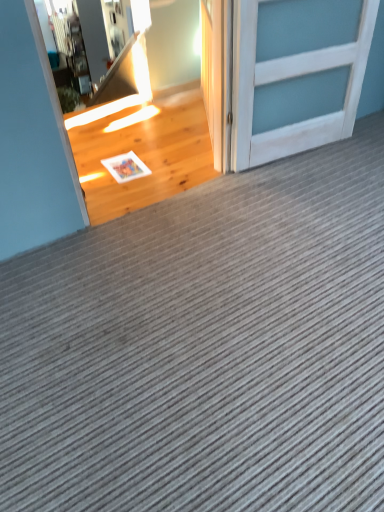
You are a GUI agent. You are given a task and a screenshot of the screen. Output one action in this format:
    pyautogui.click(x=<x>, y=<y>)
    Task: Click on the white wood door at upper right, placed as the 2th door when sorted from right to left
    
    Given the screenshot: What is the action you would take?
    pyautogui.click(x=213, y=73)

The width and height of the screenshot is (384, 512). What do you see at coordinates (213, 73) in the screenshot?
I see `white wood door at upper right, placed as the 2th door when sorted from right to left` at bounding box center [213, 73].

The width and height of the screenshot is (384, 512). What do you see at coordinates (292, 87) in the screenshot? I see `white wood door at upper right, the second door when ordered from left to right` at bounding box center [292, 87].

Locate an element on the screen. Image resolution: width=384 pixels, height=512 pixels. white wood door at upper right, the first door when ordered from right to left is located at coordinates (292, 87).

This screenshot has width=384, height=512. What are the coordinates of `white wood door at upper right, placed as the 2th door when sorted from right to left` in the screenshot? It's located at (213, 73).

Would you say white wood door at upper right, placed as the 1th door when sorted from left to right, is to the left or to the right of white wood door at upper right, the first door when ordered from right to left, in the picture?

From the image, it's evident that white wood door at upper right, placed as the 1th door when sorted from left to right, is to the left of white wood door at upper right, the first door when ordered from right to left.

Does white wood door at upper right, placed as the 1th door when sorted from left to right, come in front of white wood door at upper right, the first door when ordered from right to left?

No, it is behind white wood door at upper right, the first door when ordered from right to left.

Considering the positions of point (217, 16) and point (272, 66), is point (217, 16) closer or farther from the camera than point (272, 66)?

Point (217, 16) is positioned closer to the camera compared to point (272, 66).

From the image's perspective, which is below, white wood door at upper right, placed as the 1th door when sorted from left to right, or white wood door at upper right, the first door when ordered from right to left?

white wood door at upper right, the first door when ordered from right to left.

From a real-world perspective, is white wood door at upper right, placed as the 1th door when sorted from left to right, physically located above or below white wood door at upper right, the first door when ordered from right to left?

white wood door at upper right, placed as the 1th door when sorted from left to right, is below white wood door at upper right, the first door when ordered from right to left.

Looking at their sizes, would you say white wood door at upper right, placed as the 1th door when sorted from left to right, is wider or thinner than white wood door at upper right, the first door when ordered from right to left?

white wood door at upper right, placed as the 1th door when sorted from left to right, is thinner than white wood door at upper right, the first door when ordered from right to left.

Considering the relative sizes of white wood door at upper right, placed as the 1th door when sorted from left to right, and white wood door at upper right, the first door when ordered from right to left, in the image provided, is white wood door at upper right, placed as the 1th door when sorted from left to right, taller than white wood door at upper right, the first door when ordered from right to left,?

In fact, white wood door at upper right, placed as the 1th door when sorted from left to right, may be shorter than white wood door at upper right, the first door when ordered from right to left.

Considering the sizes of white wood door at upper right, placed as the 2th door when sorted from right to left, and white wood door at upper right, the first door when ordered from right to left, in the image, is white wood door at upper right, placed as the 2th door when sorted from right to left, bigger or smaller than white wood door at upper right, the first door when ordered from right to left,?

white wood door at upper right, placed as the 2th door when sorted from right to left, is smaller than white wood door at upper right, the first door when ordered from right to left.

Is white wood door at upper right, placed as the 1th door when sorted from left to right, spatially inside white wood door at upper right, the first door when ordered from right to left, or outside of it?

The correct answer is: outside.

Is white wood door at upper right, placed as the 1th door when sorted from left to right, aimed at white wood door at upper right, the second door when ordered from left to right?

No, white wood door at upper right, placed as the 1th door when sorted from left to right, is not facing towards white wood door at upper right, the second door when ordered from left to right.

Looking at this image, measure the distance from white wood door at upper right, placed as the 2th door when sorted from right to left, to white wood door at upper right, the first door when ordered from right to left.

A distance of 14.02 inches exists between white wood door at upper right, placed as the 2th door when sorted from right to left, and white wood door at upper right, the first door when ordered from right to left.

The height and width of the screenshot is (512, 384). Identify the location of door located on the right of white wood door at upper right, placed as the 1th door when sorted from left to right. (292, 87).

Based on the photo, considering the positions of objects white wood door at upper right, the first door when ordered from right to left, and white wood door at upper right, placed as the 1th door when sorted from left to right, in the image provided, who is more to the right, white wood door at upper right, the first door when ordered from right to left, or white wood door at upper right, placed as the 1th door when sorted from left to right,?

From the viewer's perspective, white wood door at upper right, the first door when ordered from right to left, appears more on the right side.

In the image, is white wood door at upper right, the first door when ordered from right to left, positioned in front of or behind white wood door at upper right, placed as the 1th door when sorted from left to right?

Clearly, white wood door at upper right, the first door when ordered from right to left, is in front of white wood door at upper right, placed as the 1th door when sorted from left to right.

Is point (354, 77) behind point (222, 85)?

Yes, it is behind point (222, 85).

From the image's perspective, is white wood door at upper right, the first door when ordered from right to left, over white wood door at upper right, placed as the 1th door when sorted from left to right?

No, from the image's perspective, white wood door at upper right, the first door when ordered from right to left, is not on top of white wood door at upper right, placed as the 1th door when sorted from left to right.

From a real-world perspective, who is located higher, white wood door at upper right, the first door when ordered from right to left, or white wood door at upper right, placed as the 2th door when sorted from right to left?

white wood door at upper right, the first door when ordered from right to left.

Which object is wider, white wood door at upper right, the second door when ordered from left to right, or white wood door at upper right, placed as the 1th door when sorted from left to right?

Wider between the two is white wood door at upper right, the second door when ordered from left to right.

Can you confirm if white wood door at upper right, the first door when ordered from right to left, is taller than white wood door at upper right, placed as the 2th door when sorted from right to left?

Indeed, white wood door at upper right, the first door when ordered from right to left, has a greater height compared to white wood door at upper right, placed as the 2th door when sorted from right to left.

Is white wood door at upper right, the first door when ordered from right to left, smaller than white wood door at upper right, placed as the 1th door when sorted from left to right?

Incorrect, white wood door at upper right, the first door when ordered from right to left, is not smaller in size than white wood door at upper right, placed as the 1th door when sorted from left to right.

Does white wood door at upper right, the second door when ordered from left to right, contain white wood door at upper right, placed as the 2th door when sorted from right to left?

No, white wood door at upper right, placed as the 2th door when sorted from right to left, is not inside white wood door at upper right, the second door when ordered from left to right.

Are white wood door at upper right, the second door when ordered from left to right, and white wood door at upper right, placed as the 2th door when sorted from right to left, beside each other?

No, white wood door at upper right, the second door when ordered from left to right, is not with white wood door at upper right, placed as the 2th door when sorted from right to left.

Is white wood door at upper right, placed as the 1th door when sorted from left to right, at the back of white wood door at upper right, the second door when ordered from left to right?

Absolutely, white wood door at upper right, the second door when ordered from left to right, is directed away from white wood door at upper right, placed as the 1th door when sorted from left to right.

What's the angular difference between white wood door at upper right, the second door when ordered from left to right, and white wood door at upper right, placed as the 1th door when sorted from left to right,'s facing directions?

white wood door at upper right, the second door when ordered from left to right, and white wood door at upper right, placed as the 1th door when sorted from left to right, are facing 114 degrees away from each other.

You are a GUI agent. You are given a task and a screenshot of the screen. Output one action in this format:
    pyautogui.click(x=<x>, y=<y>)
    Task: Click on the door behind the white wood door at upper right, the second door when ordered from left to right
    This screenshot has height=512, width=384.
    Given the screenshot: What is the action you would take?
    pyautogui.click(x=213, y=73)

Where is `door on the right side of white wood door at upper right, placed as the 1th door when sorted from left to right`? The height and width of the screenshot is (512, 384). door on the right side of white wood door at upper right, placed as the 1th door when sorted from left to right is located at coordinates (292, 87).

In the image, there is a white wood door at upper right, the second door when ordered from left to right. Where is `door above it (from the image's perspective)`? door above it (from the image's perspective) is located at coordinates (213, 73).